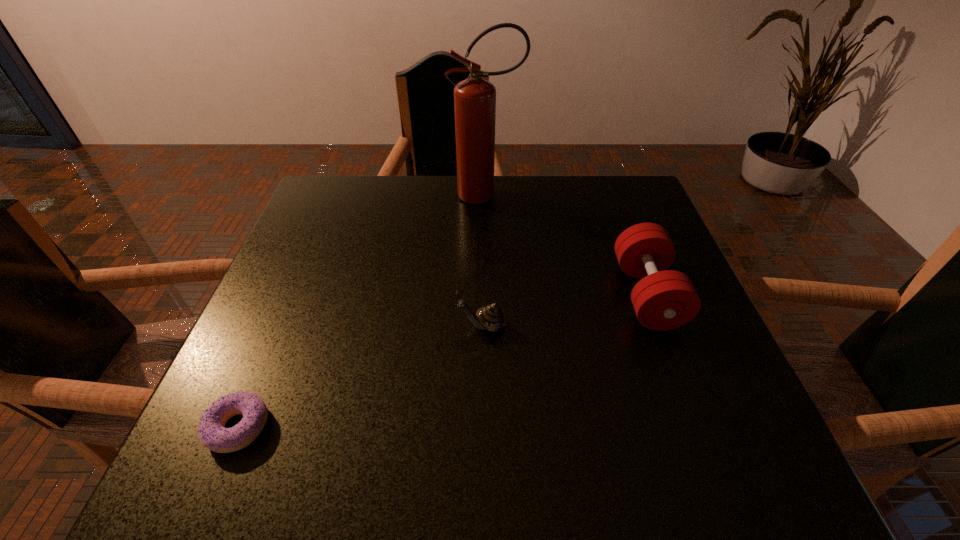
This screenshot has width=960, height=540. Find the location of `free space located on the face of the snail`. free space located on the face of the snail is located at coordinates (262, 326).

The height and width of the screenshot is (540, 960). I want to click on vacant space situated 0.270m on the face of the snail, so click(322, 326).

Find the location of a particular element. This screenshot has width=960, height=540. vacant area situated 0.350m on the face of the snail is located at coordinates (282, 326).

Locate an element on the screen. This screenshot has width=960, height=540. free space located 0.150m on the back of the doughnut is located at coordinates (278, 332).

Locate an element on the screen. object that is at the far edge is located at coordinates (474, 98).

This screenshot has width=960, height=540. Identify the location of object situated at the near edge. (212, 432).

What are the coordinates of `object that is positioned at the left edge` in the screenshot? It's located at (212, 432).

Identify the location of object located at the right edge. (664, 299).

This screenshot has height=540, width=960. What are the coordinates of `object present at the near left corner` in the screenshot? It's located at (212, 432).

The width and height of the screenshot is (960, 540). In order to click on vacant space at the far edge in this screenshot , I will do `click(391, 204)`.